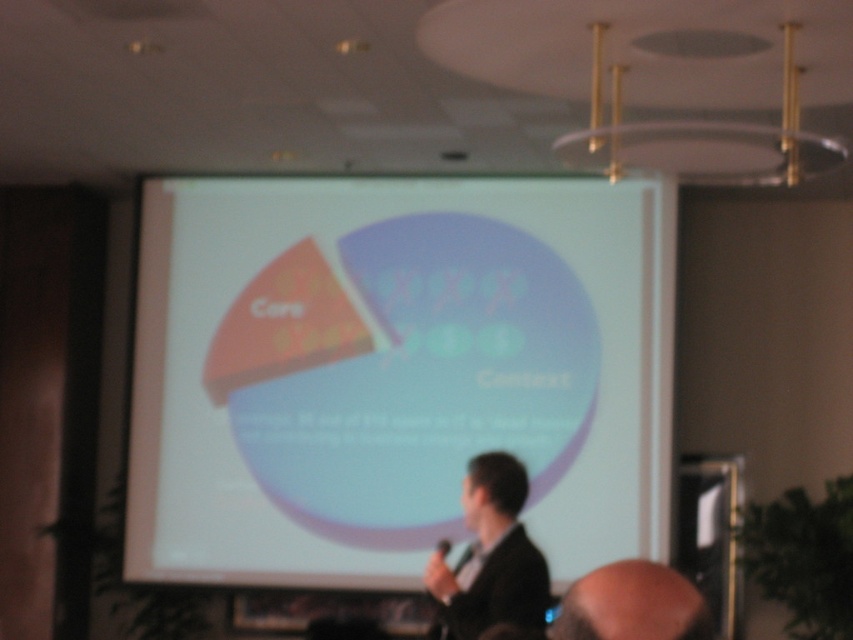
Question: Estimate the real-world distances between objects in this image. Which object is closer to the bald head at lower right?

Choices:
 (A) dark suit at center
 (B) matte white projection screen at center

Answer: (A)

Question: Is matte white projection screen at center to the left of dark suit at center from the viewer's perspective?

Choices:
 (A) no
 (B) yes

Answer: (B)

Question: Does matte white projection screen at center have a larger size compared to bald head at lower right?

Choices:
 (A) no
 (B) yes

Answer: (B)

Question: Can you confirm if matte white projection screen at center is positioned to the right of bald head at lower right?

Choices:
 (A) no
 (B) yes

Answer: (A)

Question: Which point appears farthest from the camera in this image?

Choices:
 (A) (517, 598)
 (B) (688, 579)
 (C) (637, 484)

Answer: (C)

Question: Estimate the real-world distances between objects in this image. Which object is closer to the matte white projection screen at center?

Choices:
 (A) bald head at lower right
 (B) dark suit at center

Answer: (B)